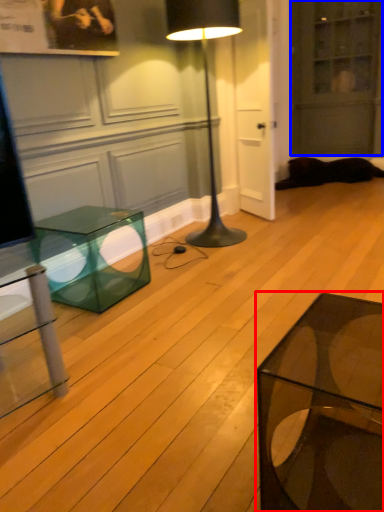
Question: Which object appears closest to the camera in this image, coffee table (highlighted by a red box) or glass door (highlighted by a blue box)?

Choices:
 (A) coffee table
 (B) glass door

Answer: (A)